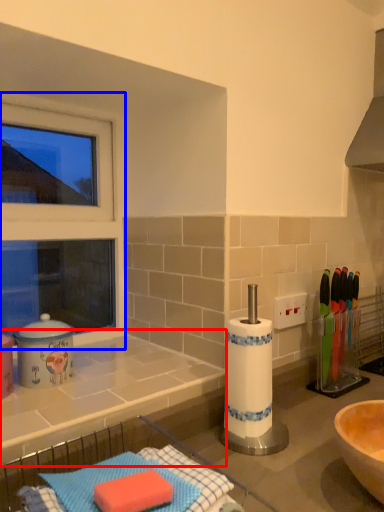
Question: Which point is closer to the camera, countertop (highlighted by a red box) or window frame (highlighted by a blue box)?

Choices:
 (A) countertop
 (B) window frame

Answer: (A)